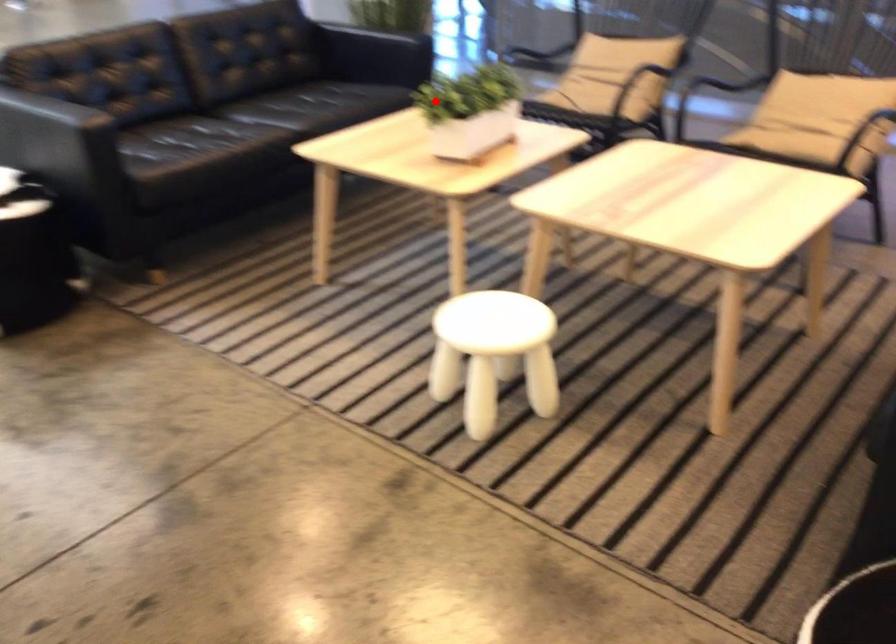
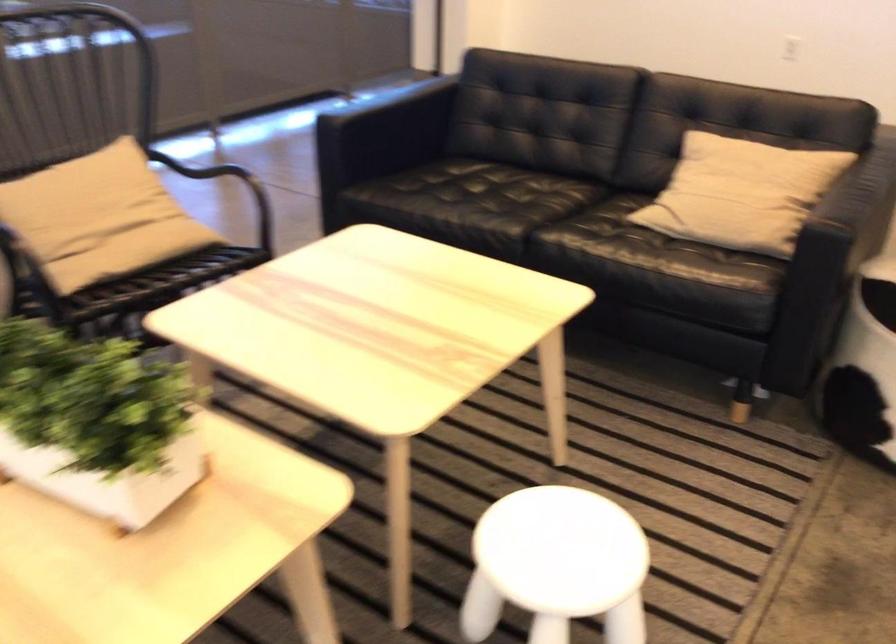
Question: I am providing you with two images of the same scene from different viewpoints. In image1, a red point is highlighted. Considering the same 3D point in image2, which of the following is correct?

Choices:
 (A) It is closer
 (B) It is farther

Answer: (A)